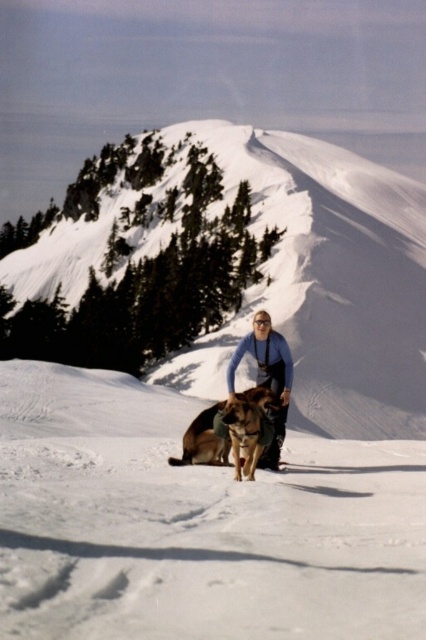
Question: Which point appears farthest from the camera in this image?

Choices:
 (A) (275, 186)
 (B) (238, 396)
 (C) (330, 449)
 (D) (252, 355)

Answer: (A)

Question: Is white fluffy snow at center bigger than snowy white mountain at center?

Choices:
 (A) no
 (B) yes

Answer: (A)

Question: Which object is the farthest from the white fluffy snow at center?

Choices:
 (A) snowy white mountain at center
 (B) brown fur dog at center

Answer: (A)

Question: Does white fluffy snow at center appear on the right side of brown fur dog at center?

Choices:
 (A) no
 (B) yes

Answer: (B)

Question: Where is snowy white mountain at center located in relation to brown fur dog at center in the image?

Choices:
 (A) left
 (B) right

Answer: (A)

Question: Which object is the farthest from the white fluffy snow at center?

Choices:
 (A) brown fur dog at center
 (B) light blue fleece jacket at center
 (C) snowy white mountain at center

Answer: (C)